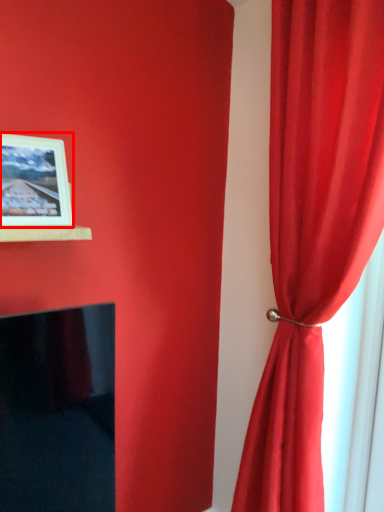
Question: From the image's perspective, where is picture frame (annotated by the red box) located in relation to curtain in the image?

Choices:
 (A) below
 (B) above

Answer: (B)